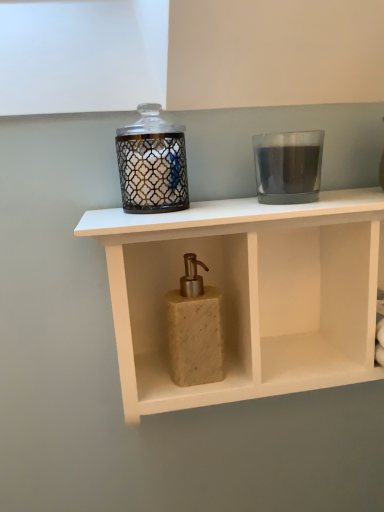
I want to click on free space that is in between matte glass candle holder at upper center, which is counted as the 2th candle holder, starting from the right, and transparent glass candle at upper right, the second candle holder positioned from the left, so click(x=214, y=206).